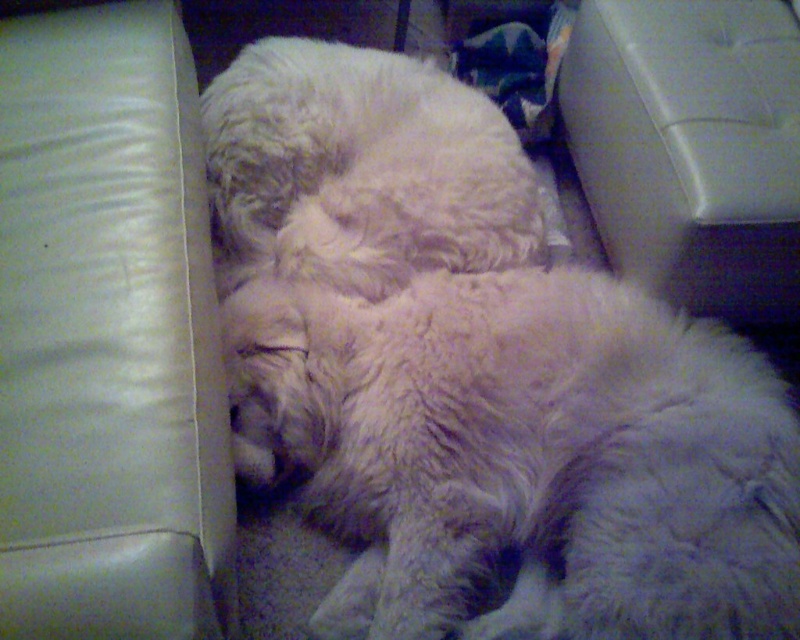
Question: Which point is farther to the camera?

Choices:
 (A) (604, 227)
 (B) (421, 576)

Answer: (A)

Question: Which object appears farthest from the camera in this image?

Choices:
 (A) fuzzy white dog at center
 (B) fluffy white cat at center

Answer: (A)

Question: Can you confirm if fluffy white cat at center is thinner than fuzzy white dog at center?

Choices:
 (A) no
 (B) yes

Answer: (A)

Question: Observing the image, what is the correct spatial positioning of fluffy white cat at center in reference to fuzzy white dog at center?

Choices:
 (A) right
 (B) left

Answer: (B)

Question: Does fluffy white cat at center have a lesser width compared to fuzzy white dog at center?

Choices:
 (A) no
 (B) yes

Answer: (A)